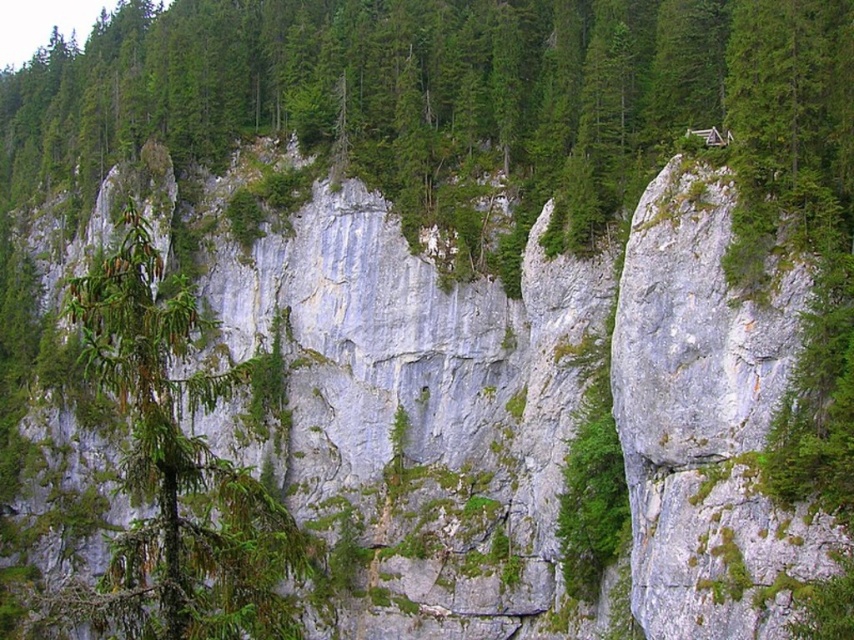
Does green matte tree at center lie in front of green matte tree at left?

No, it is behind green matte tree at left.

Is green matte tree at center to the right of green matte tree at left from the viewer's perspective?

In fact, green matte tree at center is to the left of green matte tree at left.

Does point (203, 22) come closer to viewer compared to point (202, 566)?

No, it is not.

Where is `green matte tree at center`? The image size is (854, 640). green matte tree at center is located at coordinates (458, 99).